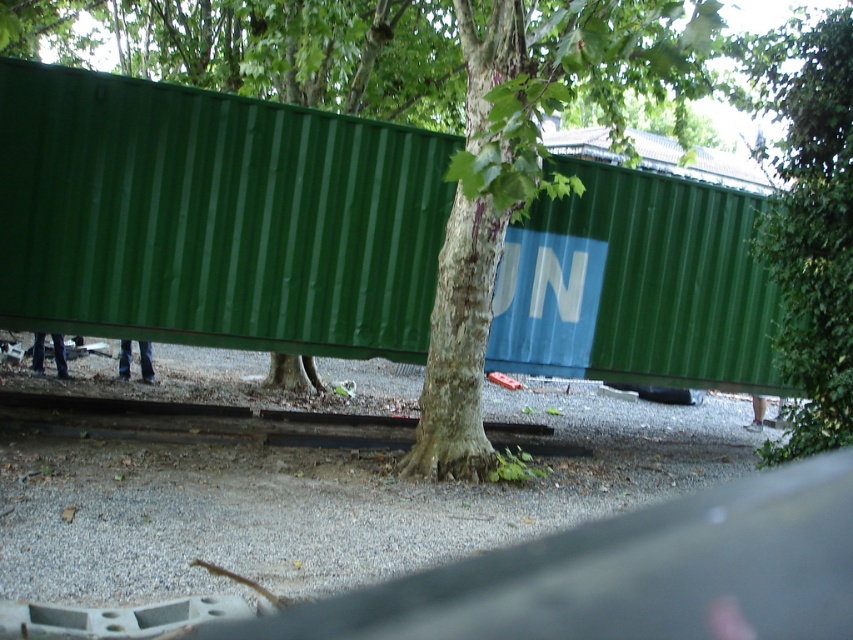
You are a warehouse manager trying to fit a new container into the space between the two existing containers. You see the green corrugated metal shipping container at center and the green corrugated metal at center. Which one is wider, and can you estimate the minimum width needed for the new container?

The green corrugated metal shipping container at center is wider than the green corrugated metal at center. To ensure the new container fits, the minimum width needed should be greater than the width of the green corrugated metal shipping container at center.

You are a train conductor approaching the green corrugated metal shipping container at center and the metallic gray train track at center. Which object is closer to your current position?

The green corrugated metal shipping container at center is closer to your current position because the metallic gray train track at center is behind it.

You are a train conductor approaching the green corrugated metal at center and the metallic gray train track at center. Which object takes up more space in the scene?

The metallic gray train track at center occupies more space than the green corrugated metal at center.